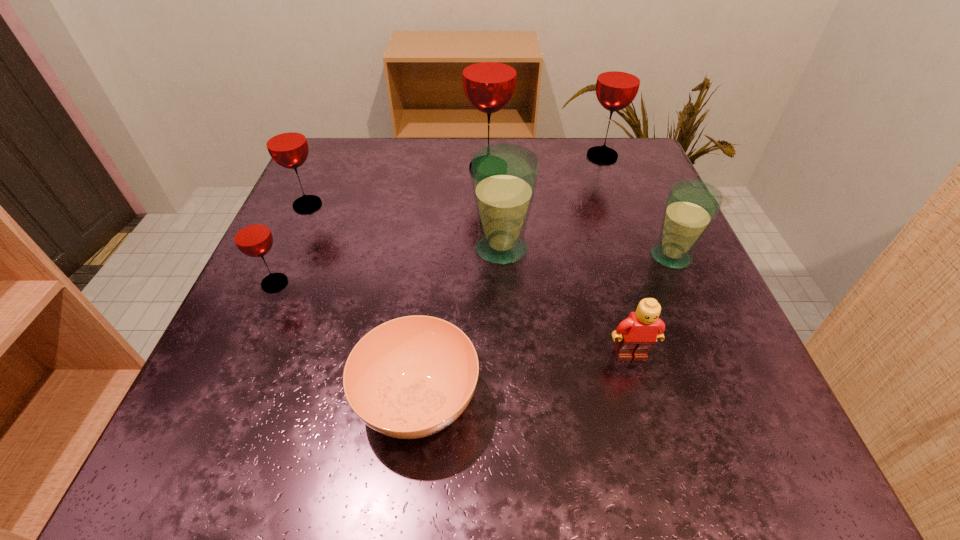
Image resolution: width=960 pixels, height=540 pixels. What are the coordinates of `the biggest red glass` in the screenshot? It's located at (489, 69).

Locate an element on the screen. the tallest glass is located at coordinates (489, 69).

Where is `the fifth shortest glass`? The height and width of the screenshot is (540, 960). the fifth shortest glass is located at coordinates (618, 81).

This screenshot has width=960, height=540. I want to click on the rightmost red glass, so click(x=618, y=81).

Where is `the third farthest object`? the third farthest object is located at coordinates (286, 142).

Locate an element on the screen. the fourth nearest glass is located at coordinates [x=286, y=142].

Find the location of a particular element. the left blue glass is located at coordinates (504, 176).

The width and height of the screenshot is (960, 540). I want to click on the smallest red glass, so click(x=252, y=236).

Where is `the right blue glass`? the right blue glass is located at coordinates (691, 206).

The height and width of the screenshot is (540, 960). In order to click on brown Lego in this screenshot , I will do `click(636, 335)`.